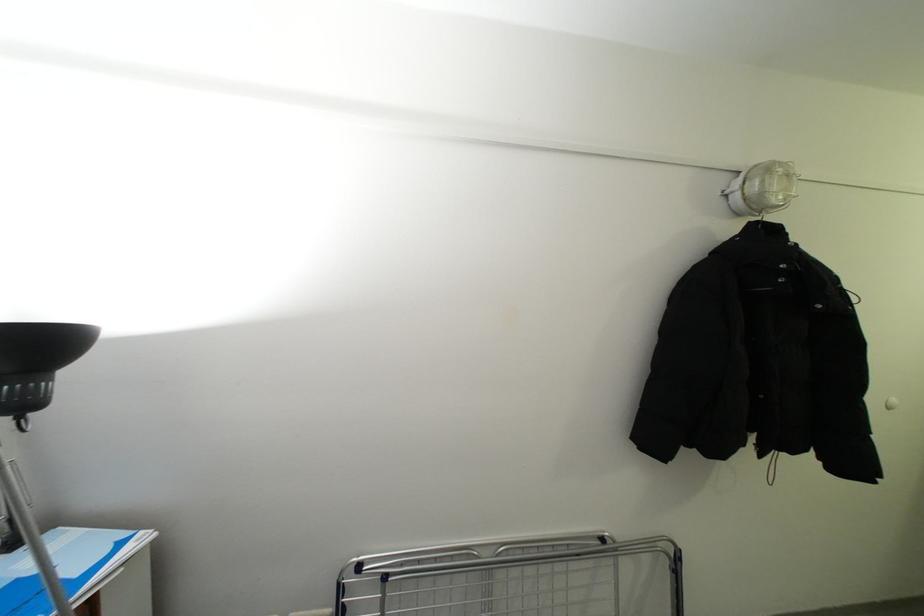
Find where to lift the clothes hanger hook. Please return your answer as a coordinate pair (x, y).

(761, 216)